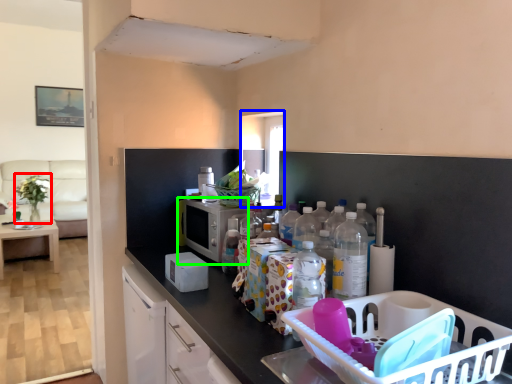
Question: Which is farther away from plant (highlighted by a red box)? window (highlighted by a blue box) or appliance (highlighted by a green box)?

Choices:
 (A) window
 (B) appliance

Answer: (A)